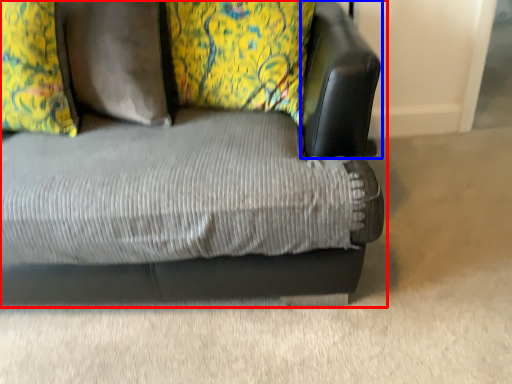
Question: Which object appears closest to the camera in this image, studio couch (highlighted by a red box) or swivel chair (highlighted by a blue box)?

Choices:
 (A) studio couch
 (B) swivel chair

Answer: (A)